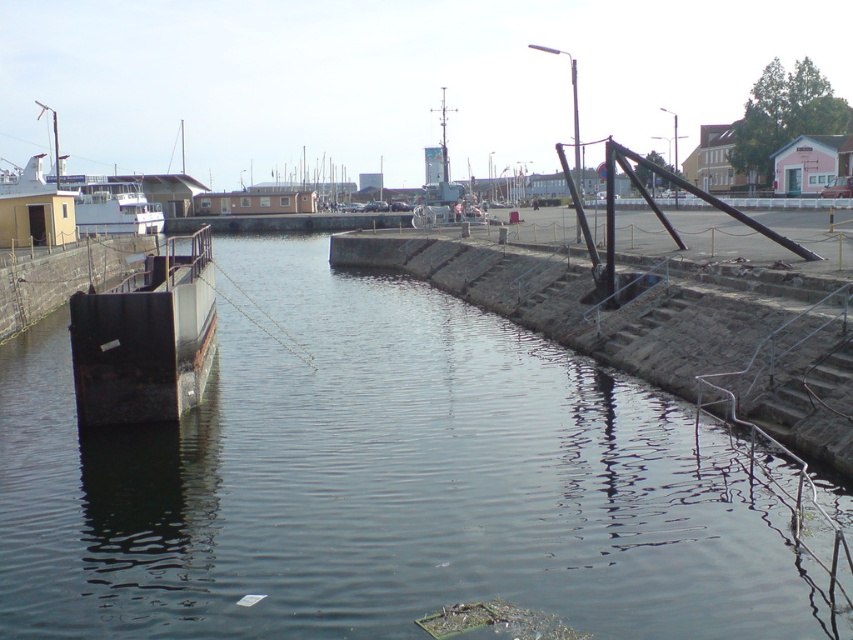
Question: Which point is farther to the camera?

Choices:
 (A) (277, 461)
 (B) (189, 266)

Answer: (B)

Question: Which point is closer to the camera?

Choices:
 (A) (134, 228)
 (B) (427, 557)

Answer: (B)

Question: Can you confirm if rusty metal barge at left is positioned to the left of white matte boat at left?

Choices:
 (A) no
 (B) yes

Answer: (A)

Question: From the image, what is the correct spatial relationship of dark gray water at center in relation to rusty metal barge at left?

Choices:
 (A) below
 (B) above

Answer: (A)

Question: Does rusty metal barge at left appear on the left side of white matte boat at left?

Choices:
 (A) no
 (B) yes

Answer: (A)

Question: Which of these objects is positioned farthest from the dark gray water at center?

Choices:
 (A) white matte boat at left
 (B) rusty metal barge at left

Answer: (A)